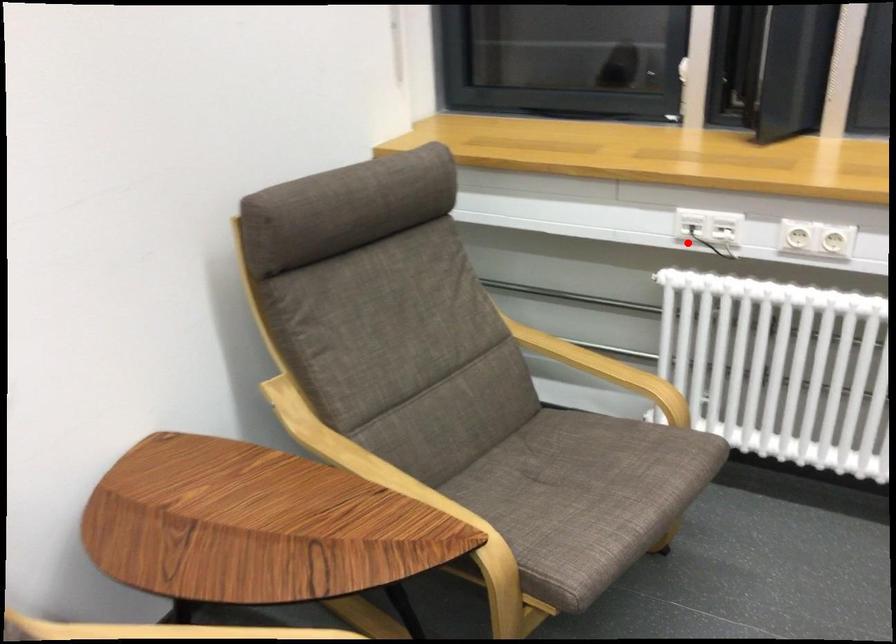
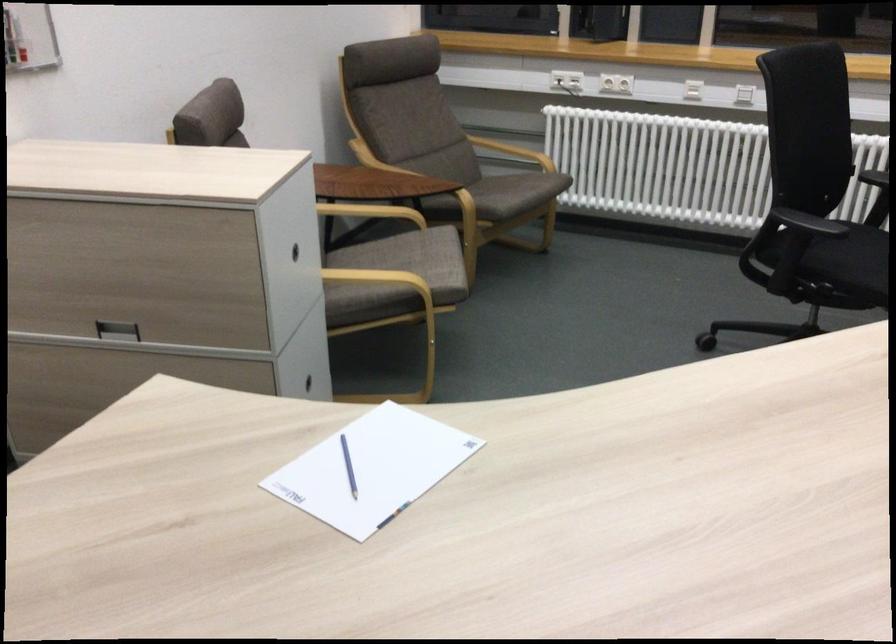
In the second image, find the point that corresponds to the highlighted location in the first image.

(566, 80)